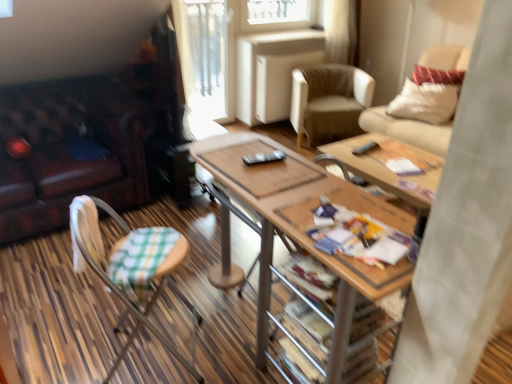
Locate an element on the screen. Image resolution: width=512 pixels, height=384 pixels. vacant space situated on the left part of black plastic remote control at center, which is the 1th remote control in front-to-back order is located at coordinates (226, 158).